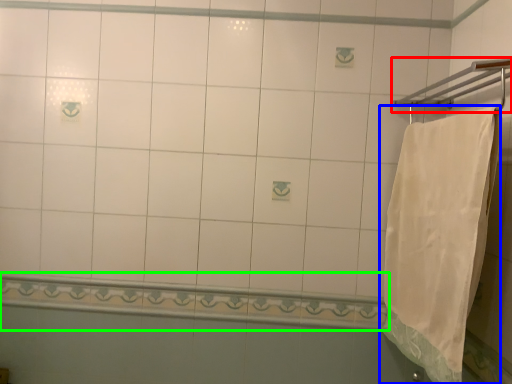
Question: Which object is positioned farthest from towel bar (highlighted by a red box)? Select from towel (highlighted by a blue box) and balustrade (highlighted by a green box).

Choices:
 (A) towel
 (B) balustrade

Answer: (B)